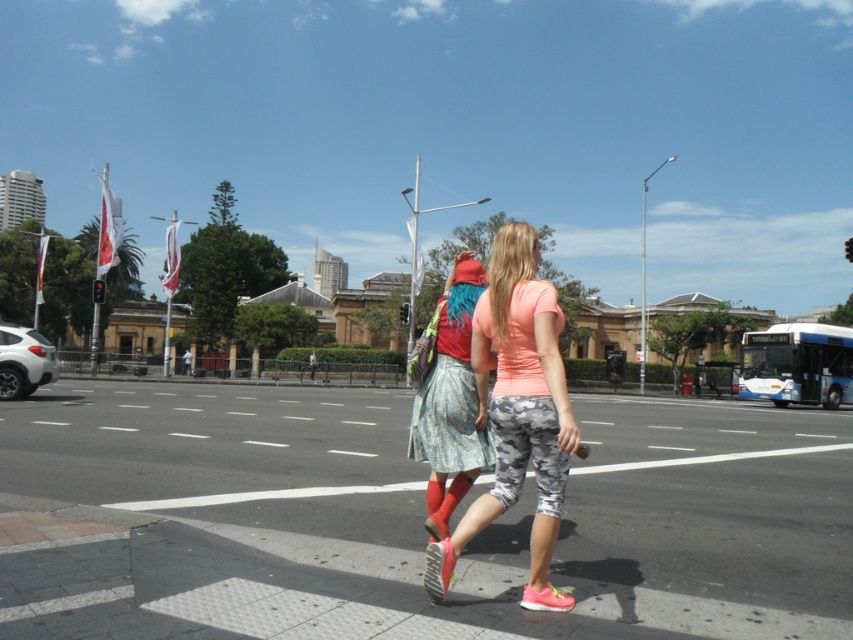
Does camouflage leggings at center appear over floral skirt at center?

Correct, camouflage leggings at center is located above floral skirt at center.

Who is lower down, camouflage leggings at center or floral skirt at center?

Positioned lower is floral skirt at center.

Between point (553, 544) and point (448, 285), which one is positioned in front?

Positioned in front is point (553, 544).

Where is `camouflage leggings at center`? The image size is (853, 640). camouflage leggings at center is located at coordinates (518, 412).